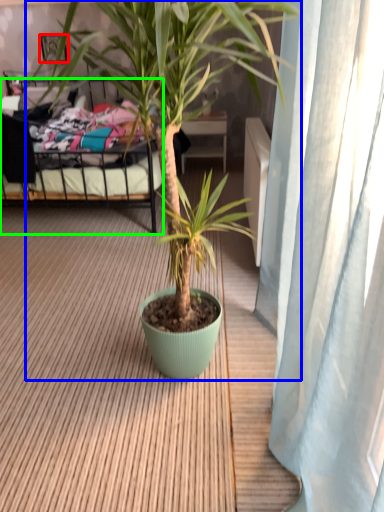
Question: Which is nearer to the picture frame (highlighted by a red box)? houseplant (highlighted by a blue box) or bed (highlighted by a green box).

Choices:
 (A) houseplant
 (B) bed

Answer: (B)